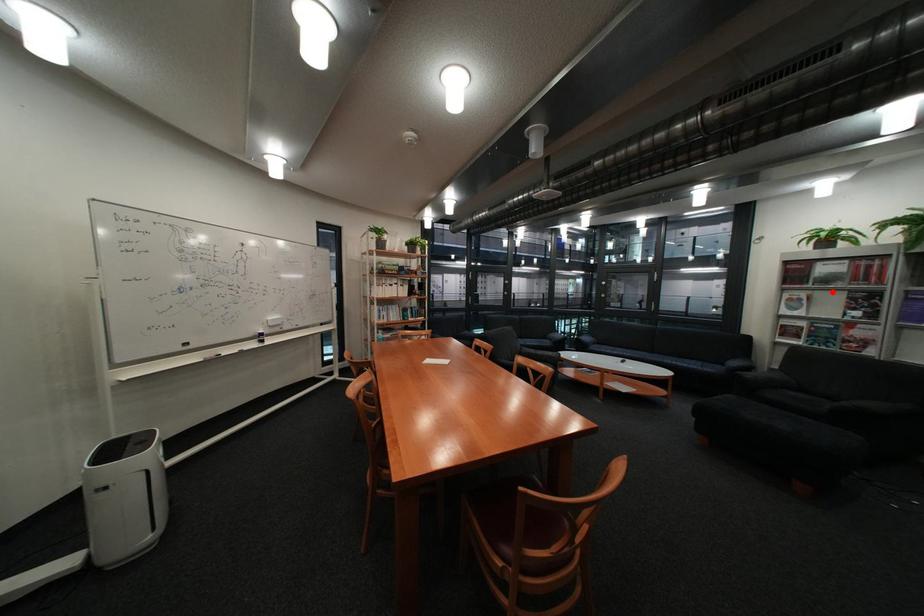
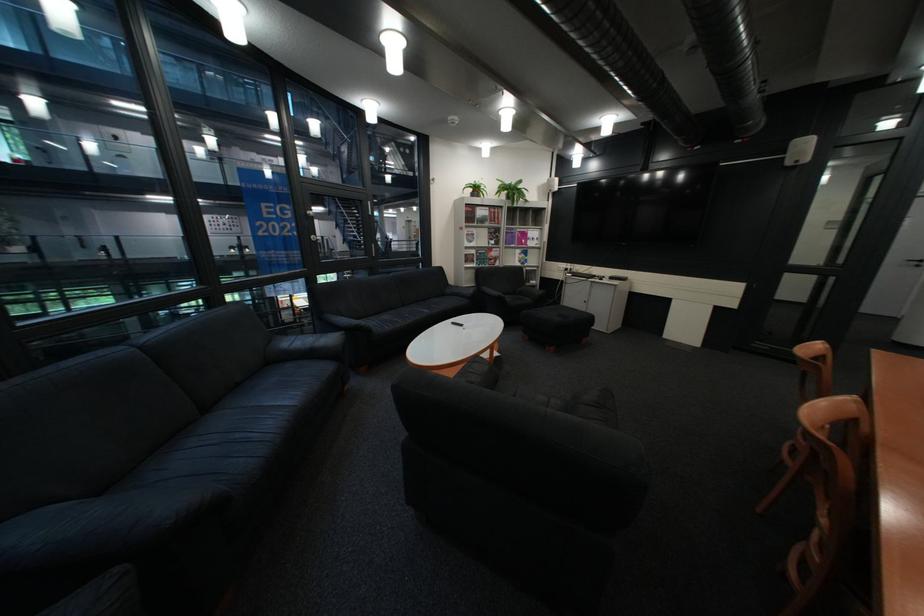
In the second image, find the point that corresponds to the highlighted location in the first image.

(492, 229)